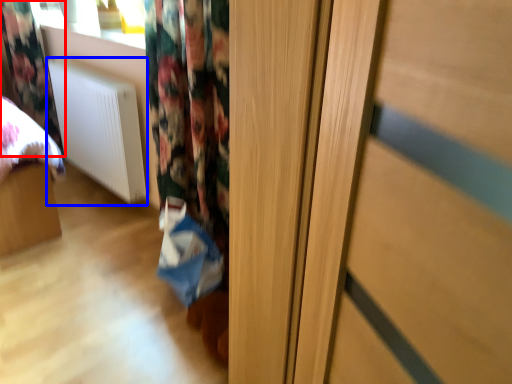
Question: Which point is further to the camera, curtain (highlighted by a red box) or radiator (highlighted by a blue box)?

Choices:
 (A) curtain
 (B) radiator

Answer: (A)